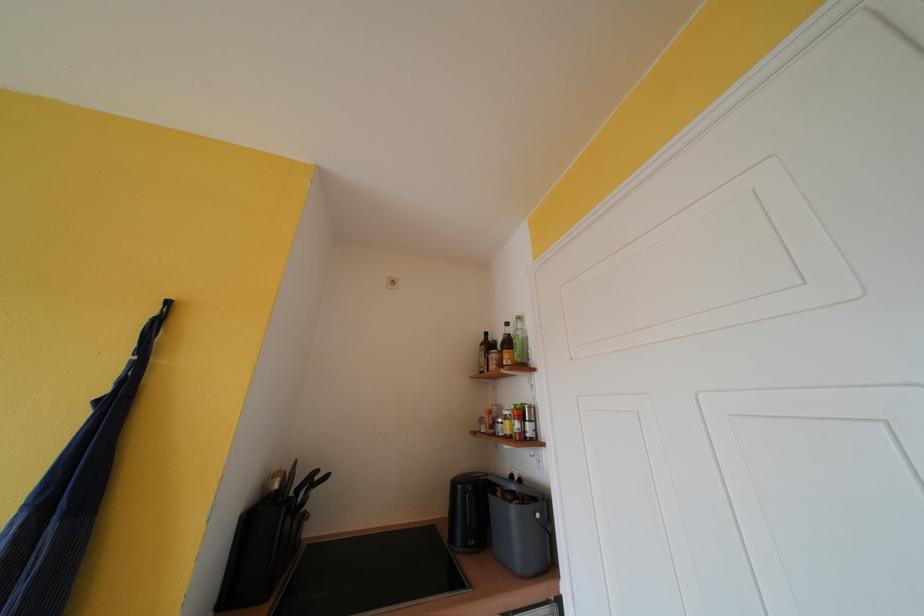
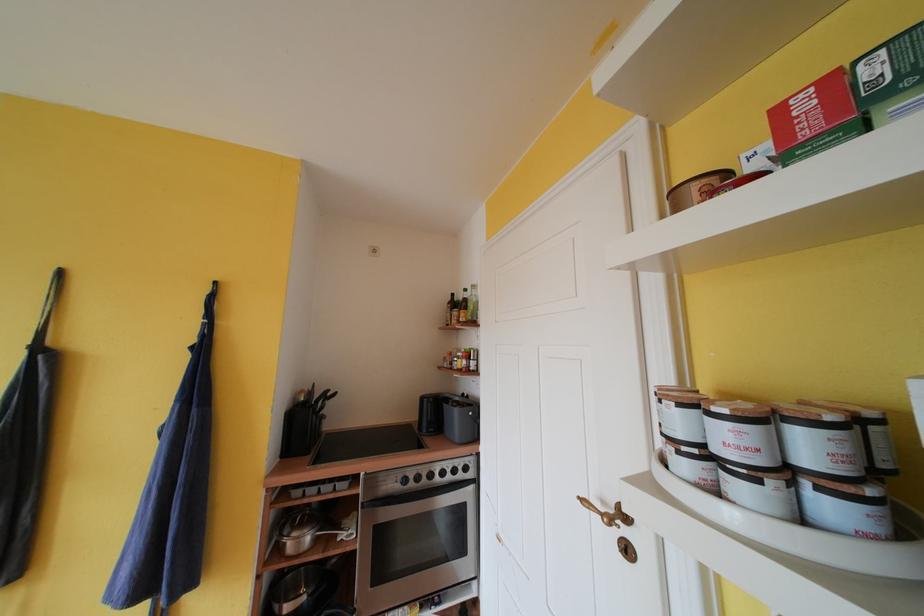
The point at (514, 328) is marked in the first image. Where is the corresponding point in the second image?

(471, 294)